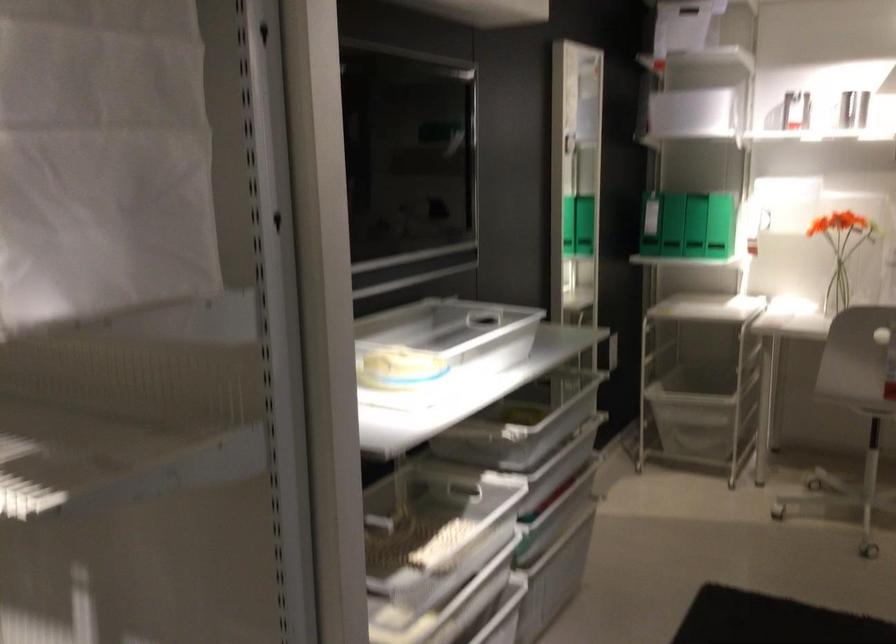
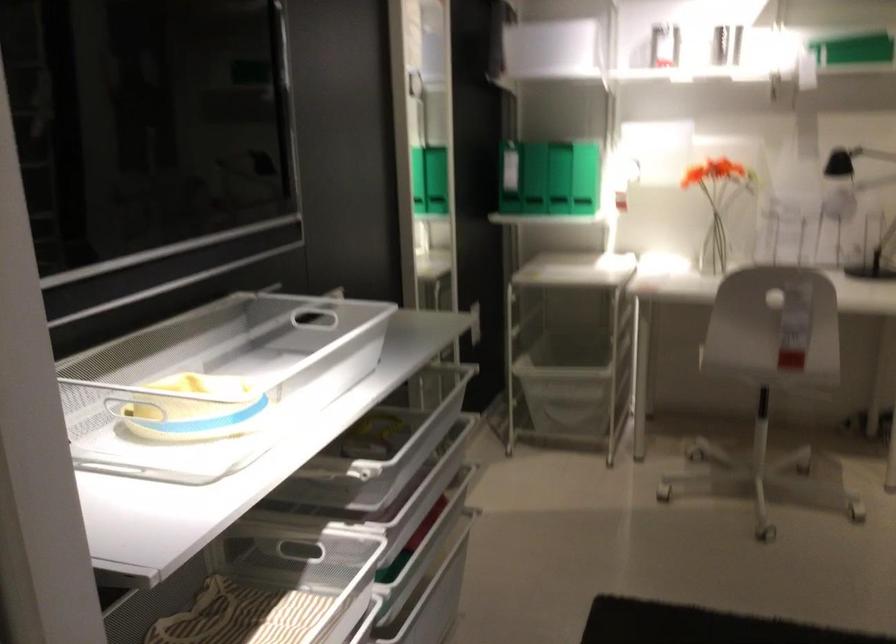
Question: Based on the continuous images, in which direction is the camera rotating? Reply with the corresponding letter.

Choices:
 (A) Left
 (B) Right
 (C) Up
 (D) Down

Answer: (B)